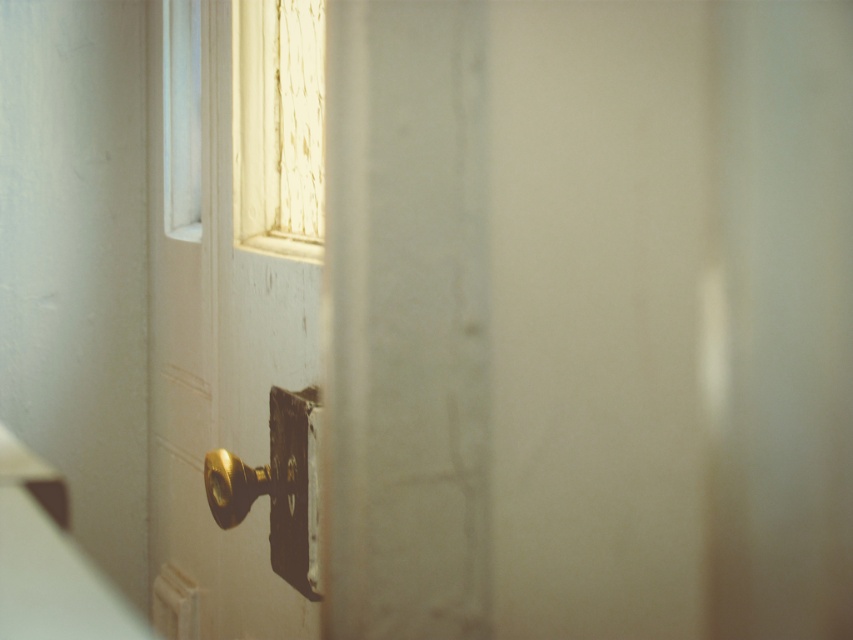
You are a painter who needs to hang a picture frame exactly between the wooden textured window at upper left and the gold polished metal door handle at center. Can you determine which object is higher so you can position the frame appropriately?

The wooden textured window at upper left has a greater height compared to the gold polished metal door handle at center, so you should position the frame between them by placing it closer to the lower side of the window and above the door handle.

You are a painter standing at the center of the room. You see the point at coordinates (277, 124). What object is located at that point?

The wooden textured window at upper left is located at point (277, 124).